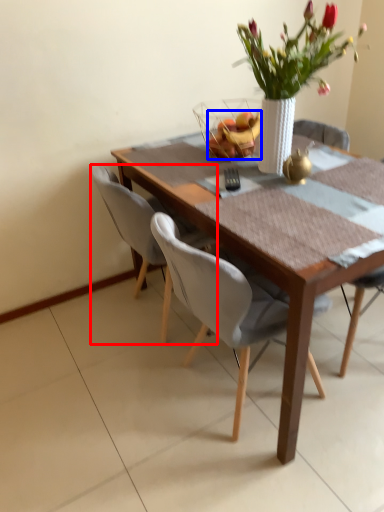
Question: Which object appears farthest to the camera in this image, chair (highlighted by a red box) or fruit (highlighted by a blue box)?

Choices:
 (A) chair
 (B) fruit

Answer: (B)